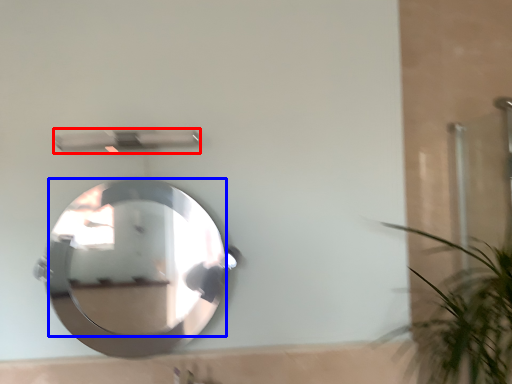
Question: Which object is closer to the camera taking this photo, shower (highlighted by a red box) or mirror (highlighted by a blue box)?

Choices:
 (A) shower
 (B) mirror

Answer: (B)